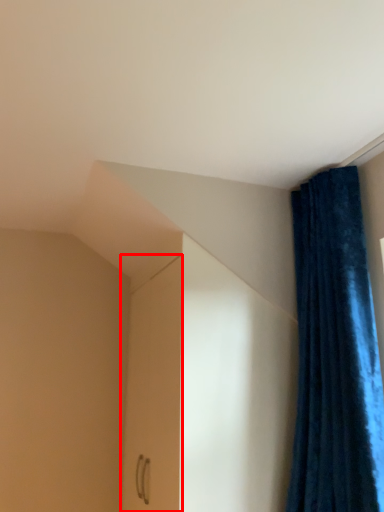
Question: In this image, where is screen door (annotated by the red box) located relative to curtain?

Choices:
 (A) left
 (B) right

Answer: (A)